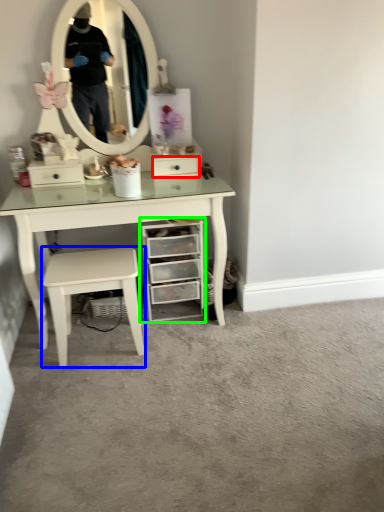
Question: Considering the real-world distances, which object is farthest from drawer (highlighted by a red box)? stool (highlighted by a blue box) or chest of drawers (highlighted by a green box)?

Choices:
 (A) stool
 (B) chest of drawers

Answer: (A)